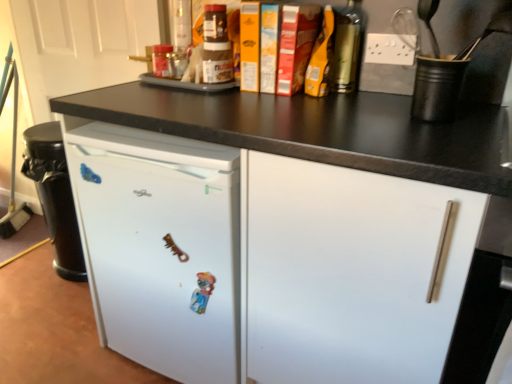
Locate an element on the screen. This screenshot has height=384, width=512. vacant space positioned to the left of black matte cup at upper right is located at coordinates tap(367, 118).